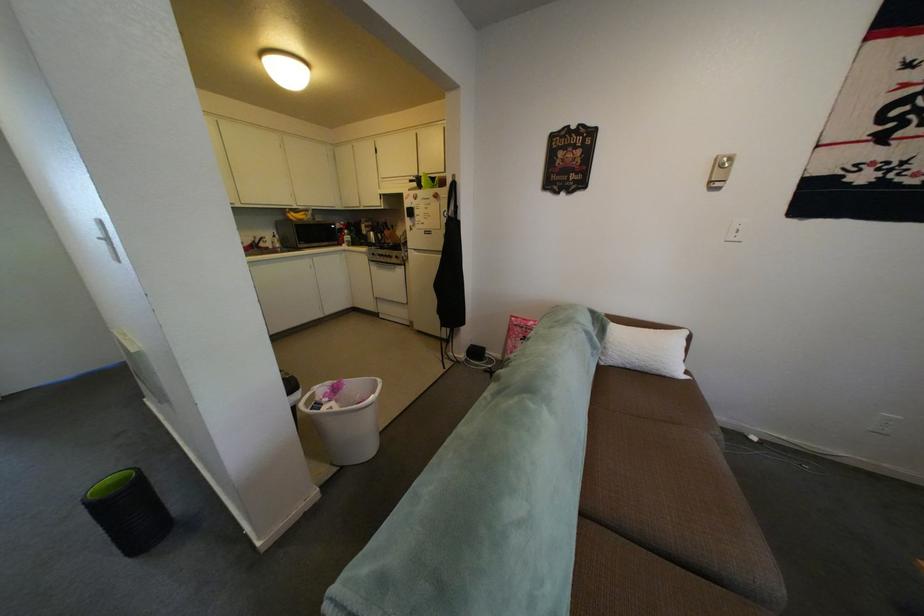
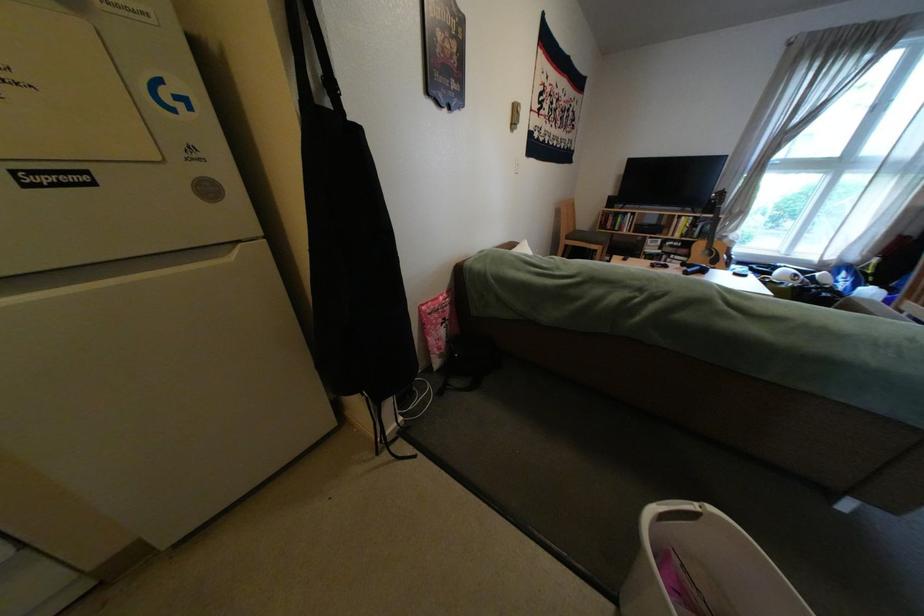
In the second image, find the point that corresponds to pixel 532 323 in the first image.

(446, 309)